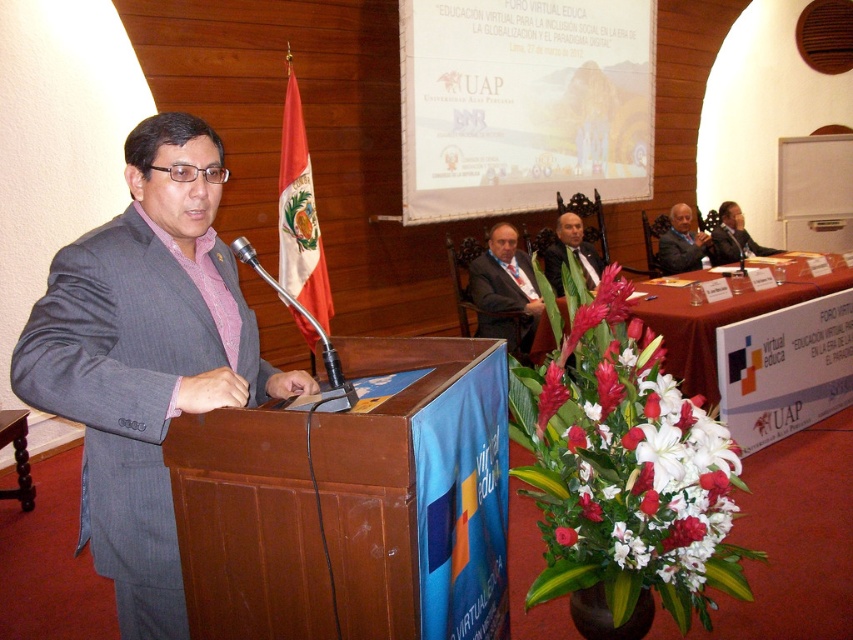
Which is above, white glossy flowers at center or red fabric flag at upper left?

red fabric flag at upper left

Does point (672, 442) lie in front of point (303, 173)?

Yes, it is.

Which is in front, point (567, 460) or point (297, 122)?

Positioned in front is point (567, 460).

I want to click on white glossy flowers at center, so click(625, 465).

Describe the element at coordinates (625, 465) in the screenshot. I see `white glossy flowers at center` at that location.

Can you confirm if white glossy flowers at center is bigger than gray fabric suit at center?

Yes, white glossy flowers at center is bigger than gray fabric suit at center.

You are a GUI agent. You are given a task and a screenshot of the screen. Output one action in this format:
    pyautogui.click(x=<x>, y=<y>)
    Task: Click on the white glossy flowers at center
    The image size is (853, 640).
    Given the screenshot: What is the action you would take?
    pyautogui.click(x=625, y=465)

Consider the image. Who is more distant from viewer, (322, 268) or (329, 368)?

The point (322, 268) is behind.

Is red fabric flag at upper left to the right of metallic silver microphone at center from the viewer's perspective?

In fact, red fabric flag at upper left is to the left of metallic silver microphone at center.

What do you see at coordinates (299, 216) in the screenshot? I see `red fabric flag at upper left` at bounding box center [299, 216].

I want to click on red fabric flag at upper left, so click(x=299, y=216).